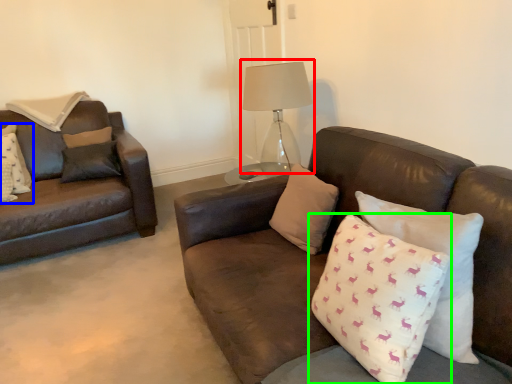
Question: Which is nearer to the table lamp (highlighted by a red box)? pillow (highlighted by a blue box) or pillow (highlighted by a green box).

Choices:
 (A) pillow
 (B) pillow

Answer: (B)